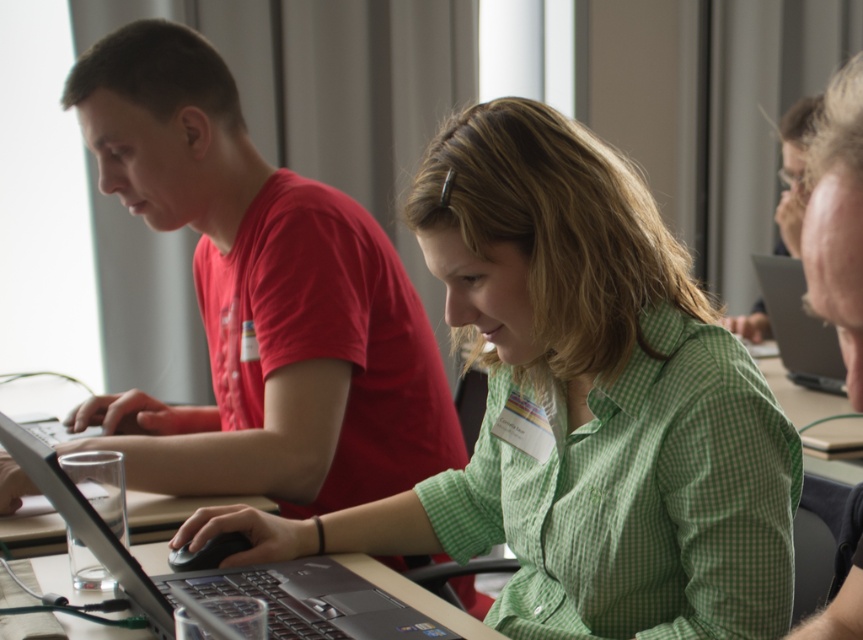
Does point (742, 451) come in front of point (17, 451)?

No, it is not.

Does matte black laptop at left have a smaller size compared to silver metallic laptop at center?

Incorrect, matte black laptop at left is not smaller in size than silver metallic laptop at center.

Between point (627, 448) and point (399, 634), which one is positioned behind?

Point (627, 448)

Identify the location of matte black laptop at left. (578, 404).

Between silver metallic laptop at center and silver metallic laptop at right, which one has less height?

silver metallic laptop at center

Who is taller, silver metallic laptop at center or silver metallic laptop at right?

With more height is silver metallic laptop at right.

Does point (112, 564) come closer to viewer compared to point (824, 337)?

Yes, point (112, 564) is closer to viewer.

Where is `silver metallic laptop at center`? silver metallic laptop at center is located at coordinates click(320, 611).

Is point (726, 424) in front of point (828, 336)?

Yes, point (726, 424) is closer to viewer.

Is point (702, 301) positioned behind point (761, 260)?

No.

You are a GUI agent. You are given a task and a screenshot of the screen. Output one action in this format:
    pyautogui.click(x=<x>, y=<y>)
    Task: Click on the matte black laptop at left
    
    Given the screenshot: What is the action you would take?
    pyautogui.click(x=578, y=404)